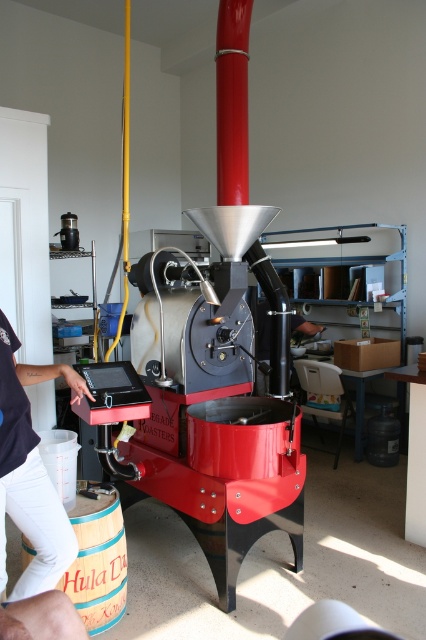
You are a visitor in the workshop and see the dark blue shirt at left and the wooden barrel at lower left. Which object is taller?

The dark blue shirt at left is much taller than the wooden barrel at lower left.